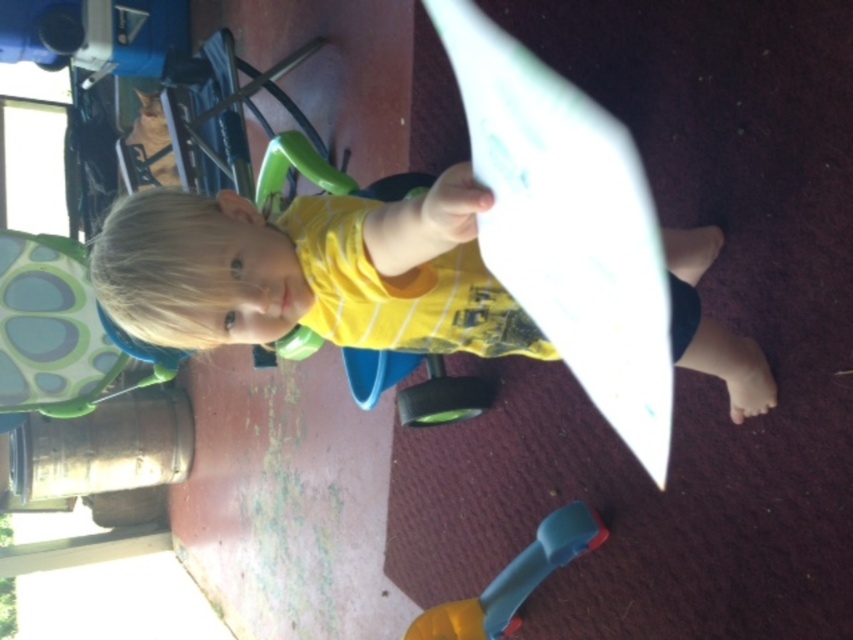
Is yellow cotton shirt at center thinner than blue plastic toy at lower center?

No.

Who is taller, yellow cotton shirt at center or blue plastic toy at lower center?

blue plastic toy at lower center

The height and width of the screenshot is (640, 853). Describe the element at coordinates (300, 268) in the screenshot. I see `yellow cotton shirt at center` at that location.

Identify the location of yellow cotton shirt at center. The height and width of the screenshot is (640, 853). (300, 268).